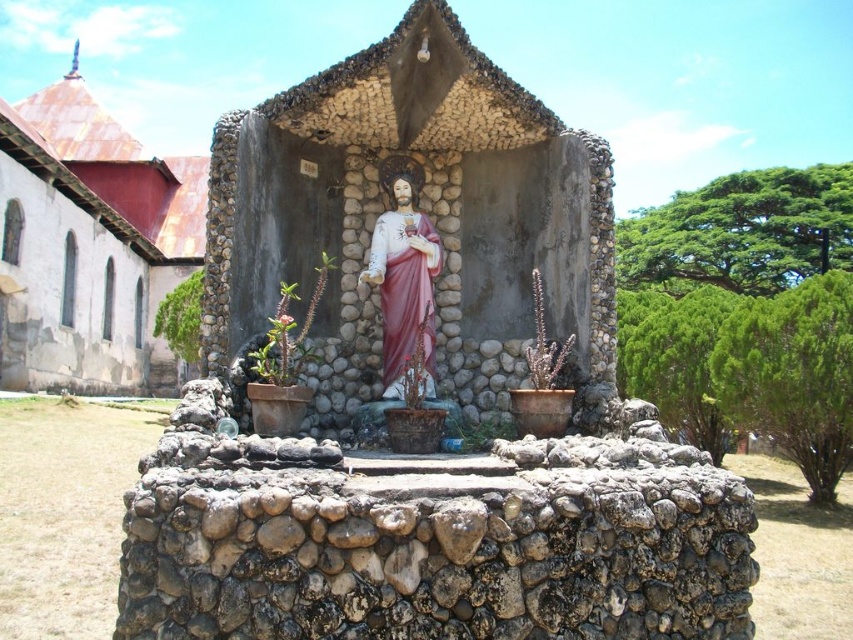
You are standing in front of the shrine and want to place a small offering on the ground near the statue. Considering the rusty metal roof at left and the matte pink statue at center, which object is closer to you?

The matte pink statue at center is closer to you because the rusty metal roof at left is located above it, meaning the statue is positioned lower and nearer in the scene.

You are a painter standing in front of the shrine. You want to paint the rusty metal roof at left and the matte pink statue at center. Which object should you focus on first if you want to paint the wider one first?

The rusty metal roof at left is wider than the matte pink statue at center, so you should focus on painting the rusty metal roof at left first.

You are standing in front of the shrine and want to take a photo of the matte pink statue at center without the rusty metal roof at left blocking the view. Is it possible to position yourself in such a way that the statue is visible while the roof is not?

The matte pink statue at center is behind the rusty metal roof at left, so if you position yourself to the side or behind the roof, you can see the statue without the roof blocking the view.